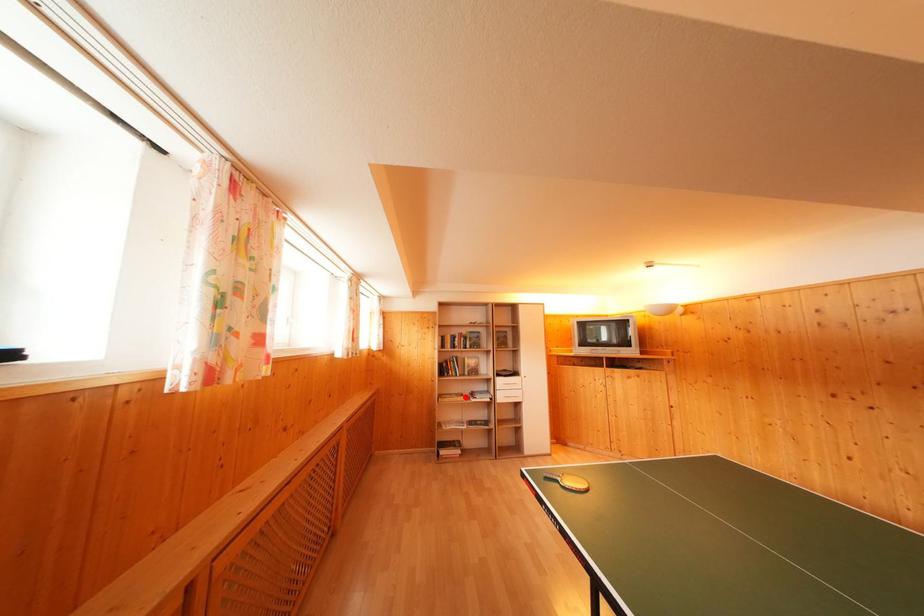
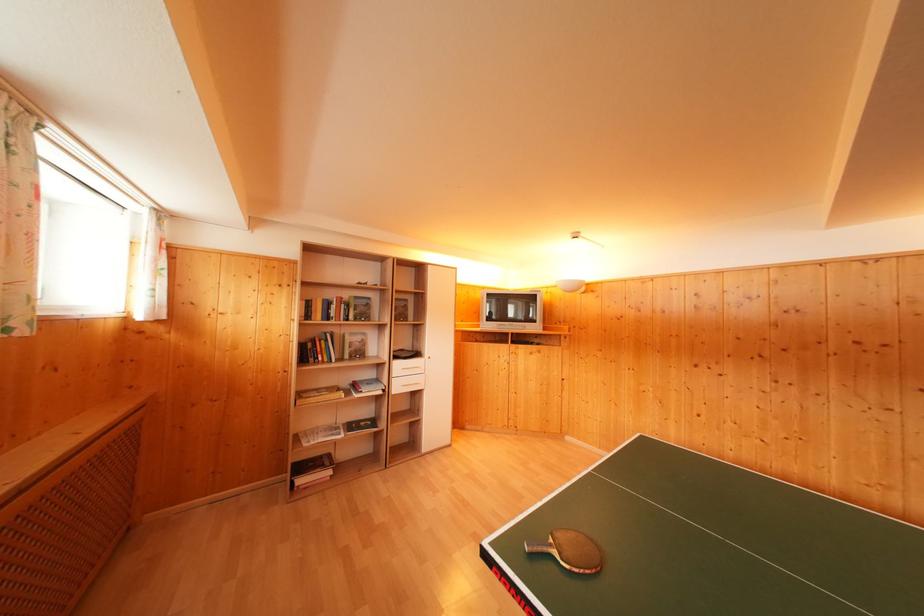
Question: I am providing you with two images of the same scene from different viewpoints. In image1, a red point is highlighted. Considering the same 3D point in image2, which of the following is correct?

Choices:
 (A) It is closer
 (B) It is farther

Answer: (A)